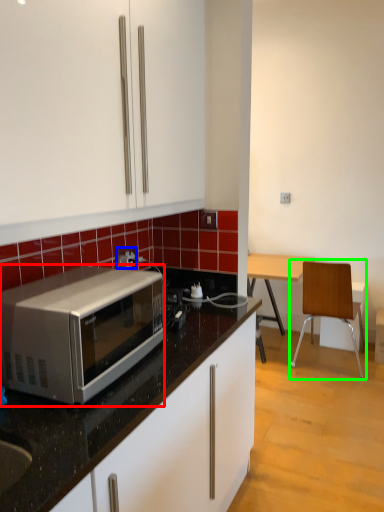
Question: Which object is the closest to the microwave oven (highlighted by a red box)? Choose among these: power outlet (highlighted by a blue box) or chair (highlighted by a green box).

Choices:
 (A) power outlet
 (B) chair

Answer: (A)